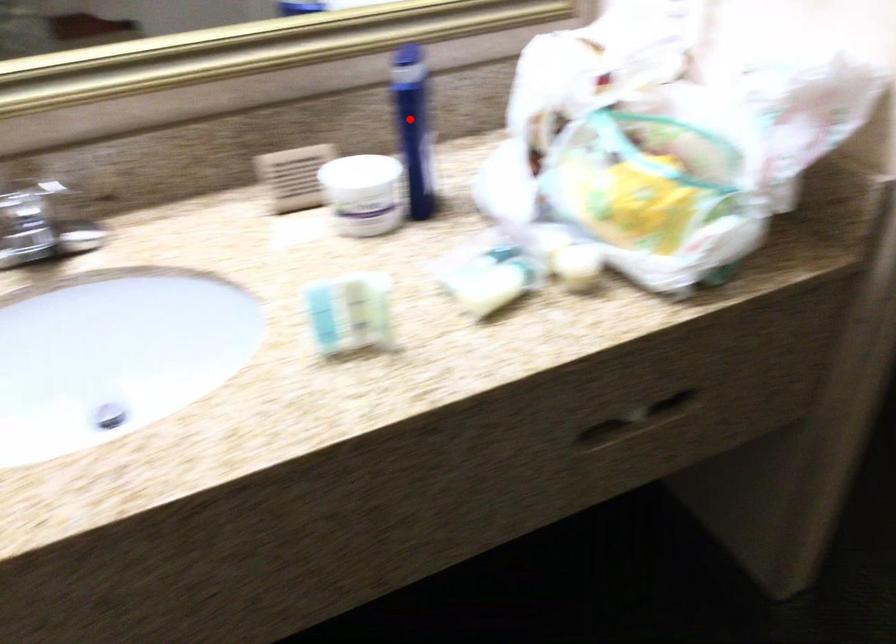
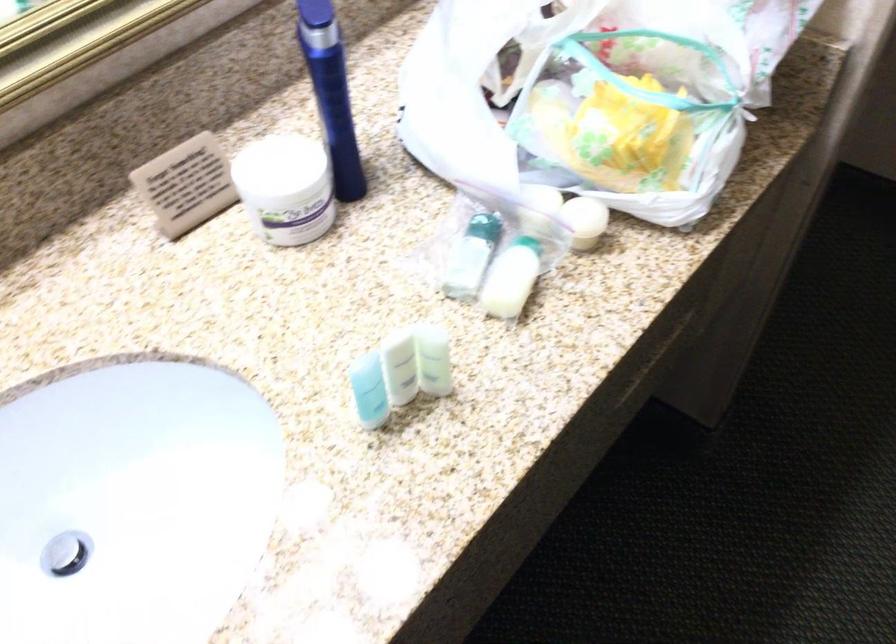
Question: I am providing you with two images of the same scene from different viewpoints. In image1, a red point is highlighted. Considering the same 3D point in image2, which of the following is correct?

Choices:
 (A) It is closer
 (B) It is farther

Answer: (A)